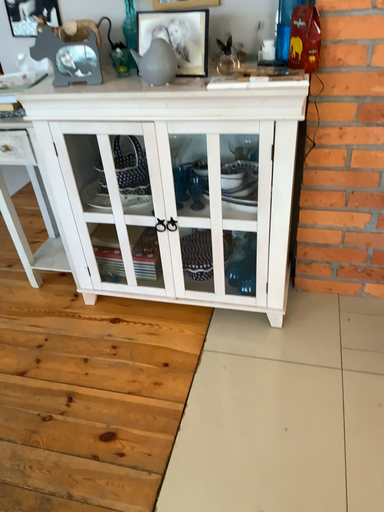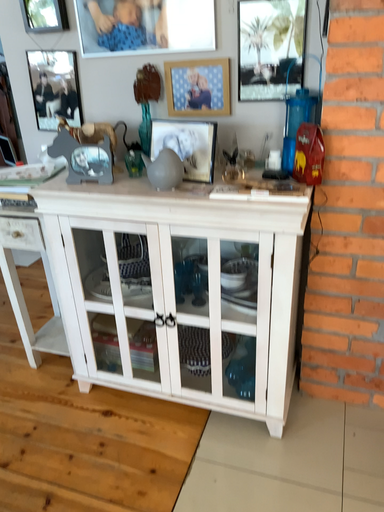
Question: Which way did the camera rotate in the video?

Choices:
 (A) rotated downward
 (B) rotated upward

Answer: (B)